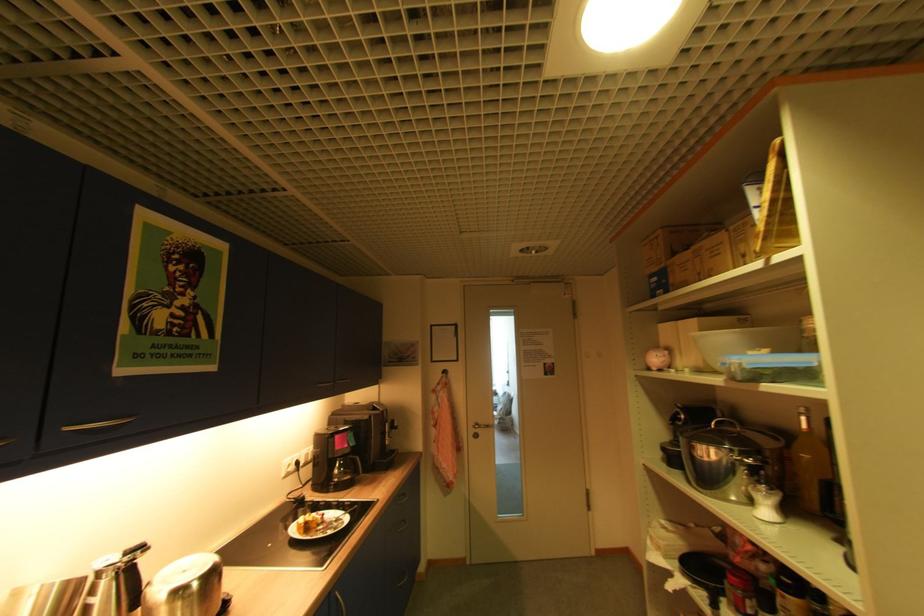
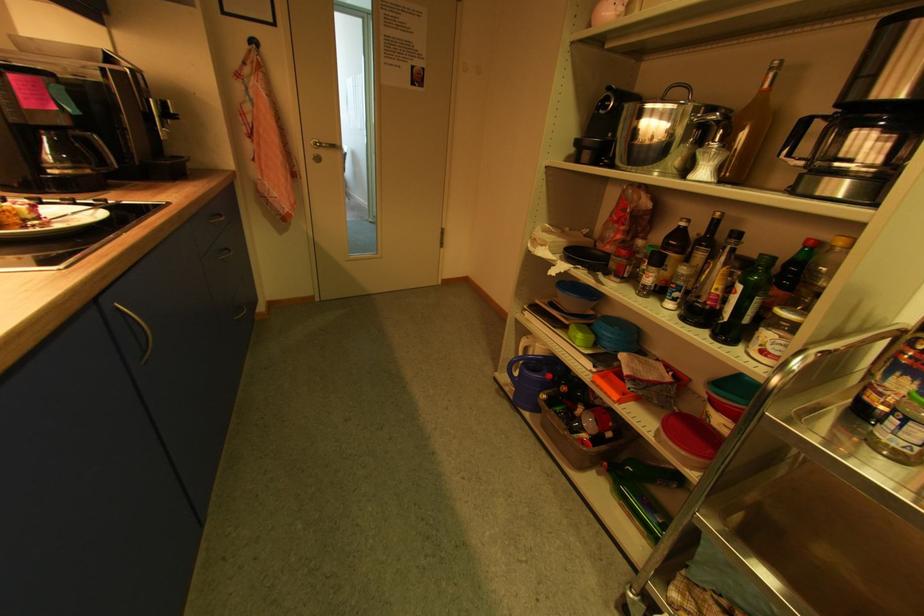
The point at (772, 513) is marked in the first image. Where is the corresponding point in the second image?

(709, 175)